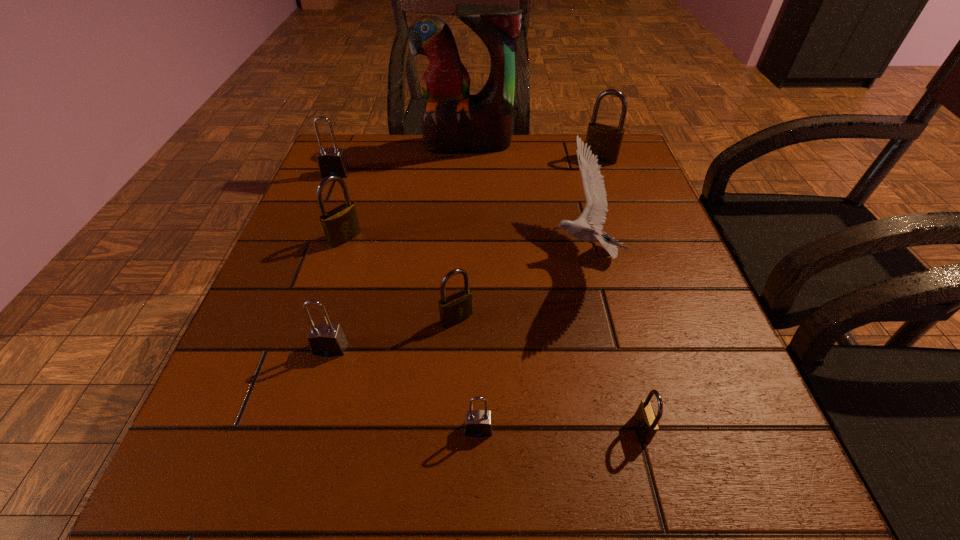
I want to click on parrot, so click(453, 121).

The width and height of the screenshot is (960, 540). I want to click on the farthest brass padlock, so tap(605, 140).

What are the coordinates of `the rightmost padlock` in the screenshot? It's located at (605, 140).

At what (x,y) coordinates should I click in order to perform the action: click on gull. Please return your answer as a coordinate pair (x, y). This screenshot has height=540, width=960. Looking at the image, I should click on (594, 214).

Where is `the second farthest padlock`? the second farthest padlock is located at coordinates (331, 161).

You are a GUI agent. You are given a task and a screenshot of the screen. Output one action in this format:
    pyautogui.click(x=<x>, y=<y>)
    Task: Click on the farthest gray padlock
    The width and height of the screenshot is (960, 540).
    Given the screenshot: What is the action you would take?
    pyautogui.click(x=331, y=161)

Where is `the third farthest padlock`? This screenshot has width=960, height=540. the third farthest padlock is located at coordinates (340, 225).

Find the location of `the third nearest brass padlock`. the third nearest brass padlock is located at coordinates (340, 225).

The height and width of the screenshot is (540, 960). Find the location of `the third nearest padlock`. the third nearest padlock is located at coordinates (325, 339).

This screenshot has height=540, width=960. What are the coordinates of `the second farthest gray padlock` in the screenshot? It's located at (325, 339).